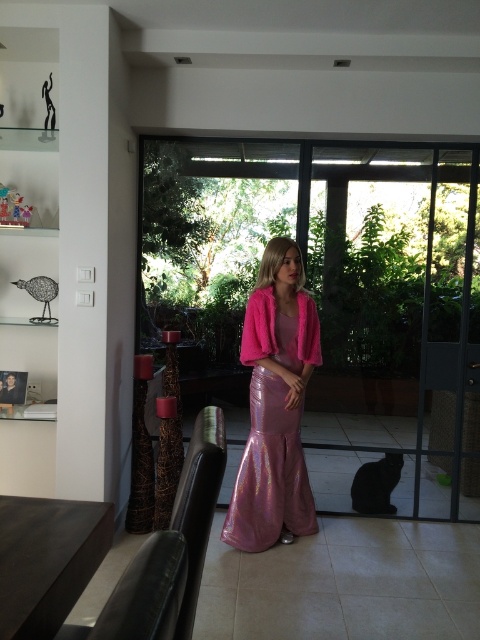
You are a photographer setting up for a shoot. You have a camera with a 24 inch focal length. You want to capture both the transparent glass door at center and the shiny pink dress at center in the same frame. Can you do this without moving either the camera or the subjects?

The distance between the transparent glass door at center and the shiny pink dress at center is 27.15 inches. Since the camera has a 24 inch focal length, which is shorter than the distance between them, it may not be able to capture both in the same frame without moving the camera or subjects.

You are a photographer setting up a shoot in this room. You need to position a large equipment bag that is the same size as the shiny pink dress at center. Will the transparent glass door at center be able to accommodate the bag if placed next to it?

The transparent glass door at center is bigger than the shiny pink dress at center, so yes, the equipment bag can be placed next to it since the door is larger in size.

You are a photographer trying to capture the shiny pink dress at center without any obstructions. The transparent glass door at center is in the way. Can you move the glass door to get a clear shot of the dress?

The transparent glass door at center is positioned over shiny pink dress at center, so moving the glass door would allow you to capture the shiny pink dress at center without obstruction.